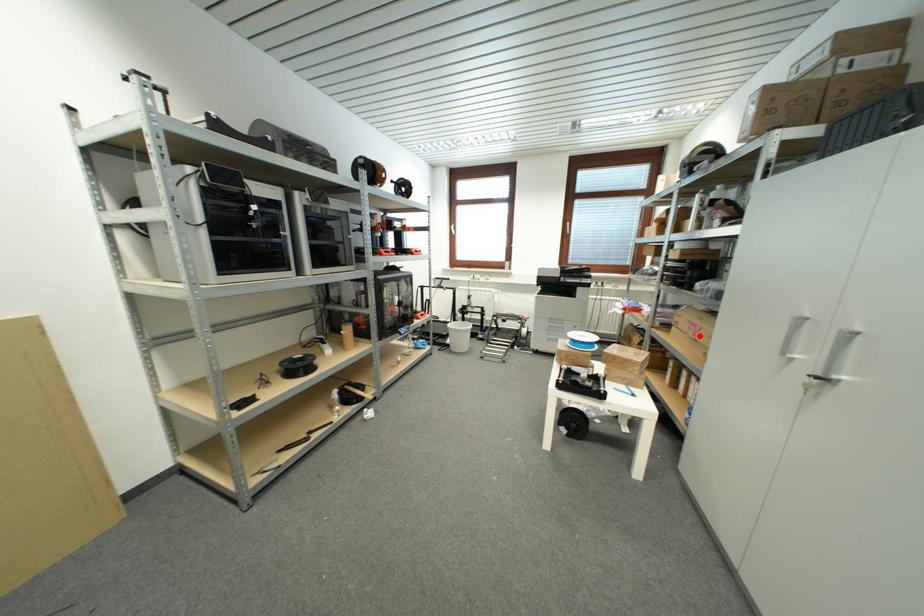
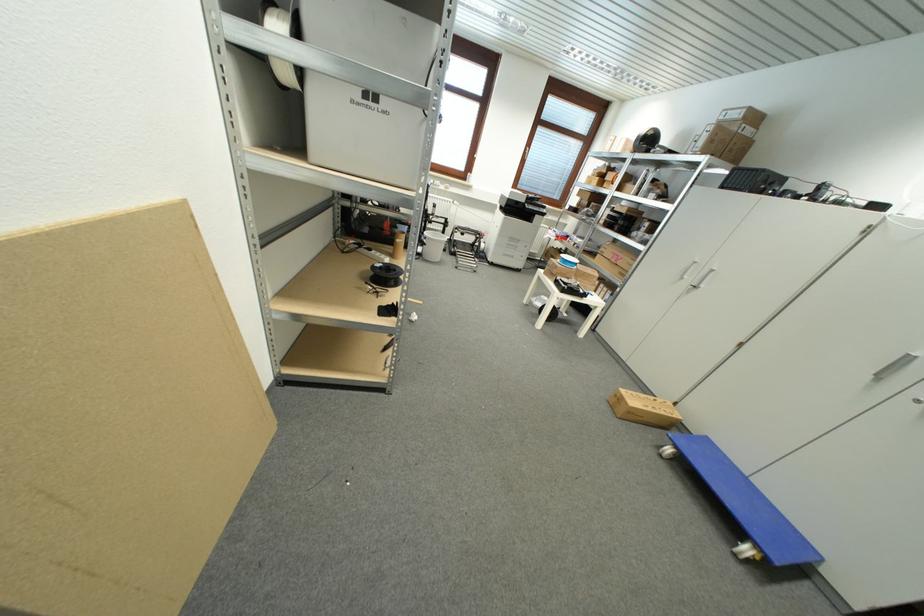
Where in the second image is the point corresponding to the highlighted location from the first image?

(621, 262)